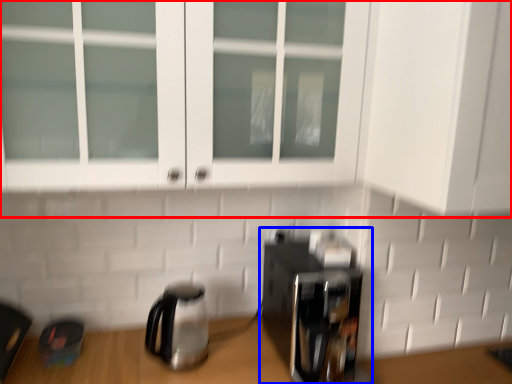
Question: Which of the following is the closest to the observer, cabinetry (highlighted by a red box) or coffee maker (highlighted by a blue box)?

Choices:
 (A) cabinetry
 (B) coffee maker

Answer: (A)